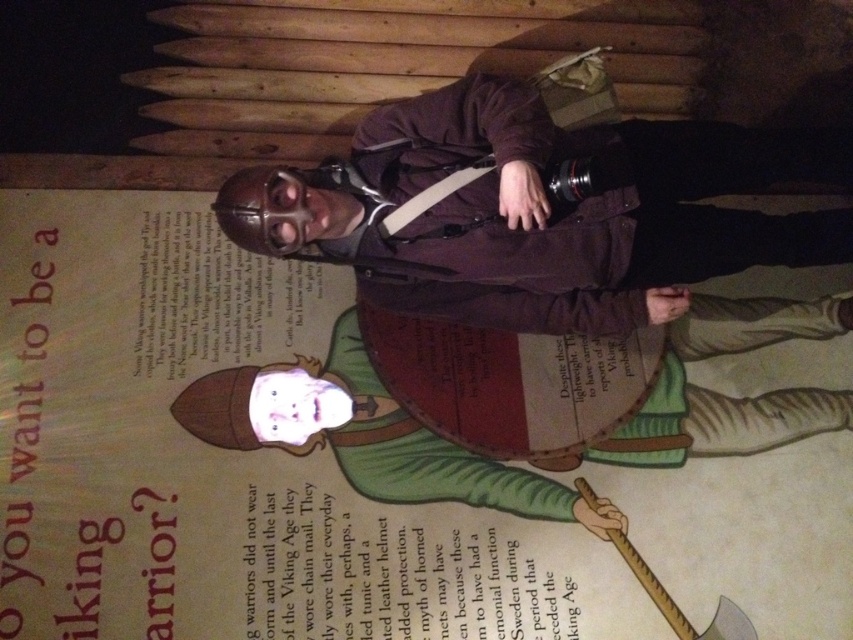
You are a costume designer preparing to create a Viking warrior outfit. You need to place the matte brown leather helmet at upper center and the green leather shield at center. According to the poster, which object should be placed higher?

The matte brown leather helmet at upper center should be placed higher than the green leather shield at center because it is positioned over the shield in the poster.

You are a photographer standing in front of the poster and wearing the matte brown leather helmet at upper center. You want to take a photo of the poster without your helmet blocking the view. Which direction should you move your head to ensure the helmet doesn t appear in the photo?

Since the matte brown leather helmet at upper center is located at point (540,211), you should move your head downward to avoid the helmet blocking the view.